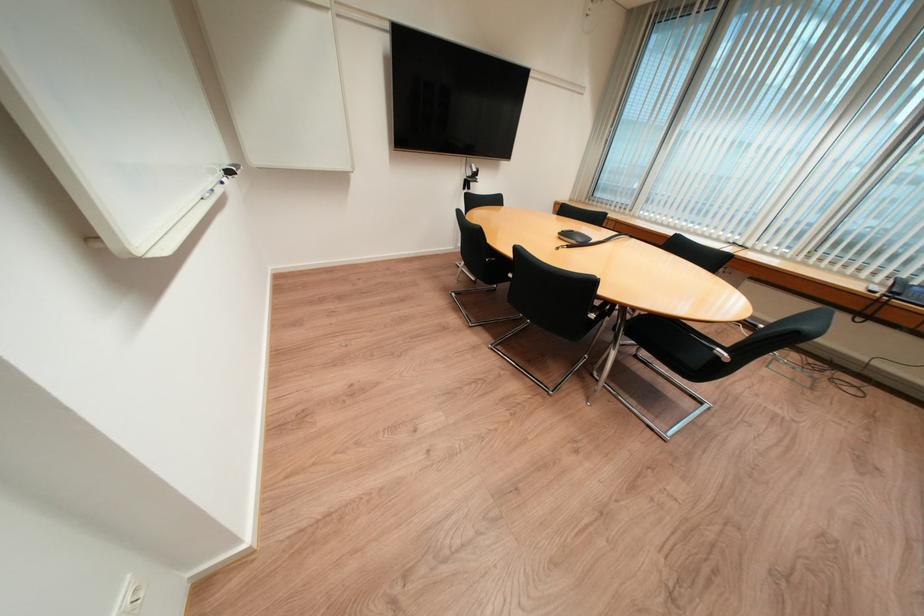
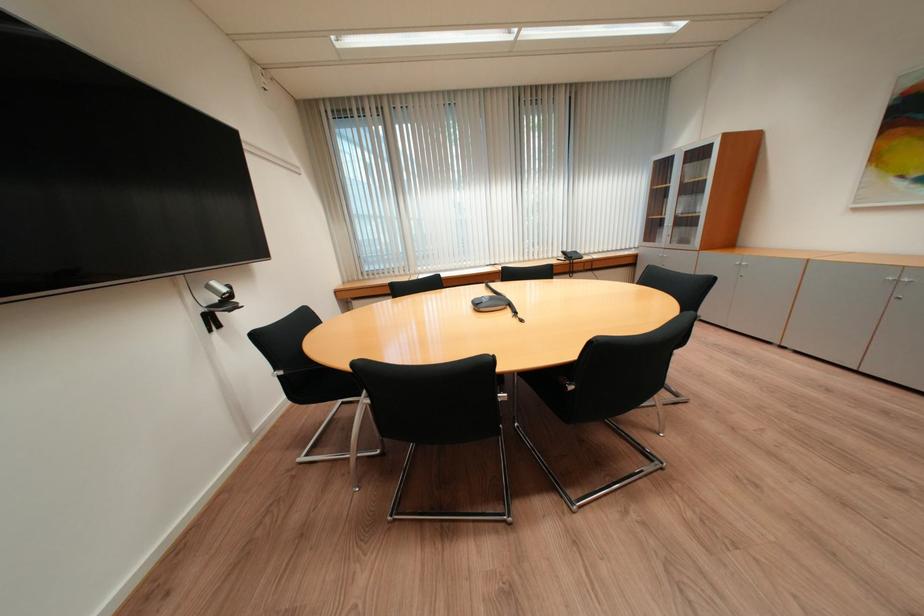
Where in the second image is the point corresponding to point 480,168 from the first image?

(217, 289)